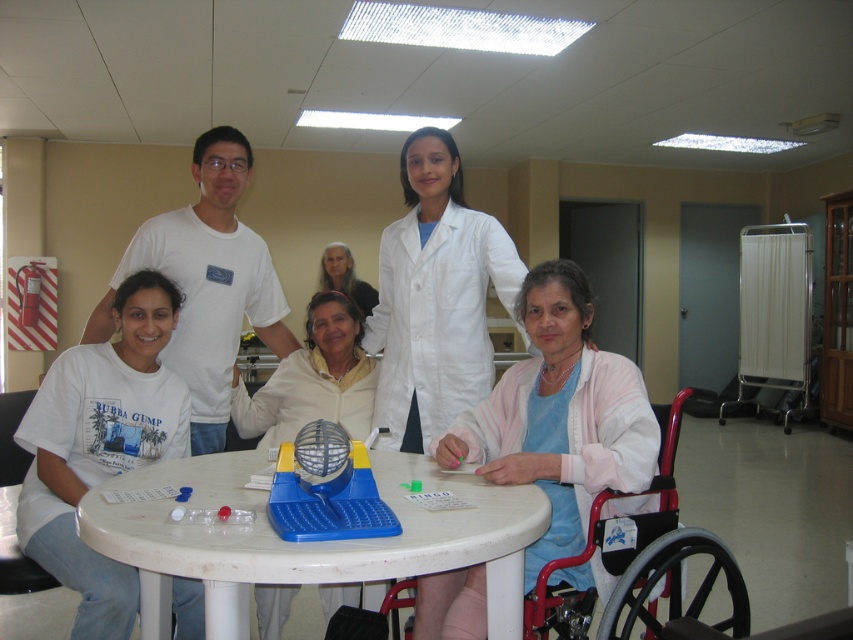
Question: Is red plastic wheelchair at lower right thinner than white matte bingo caller at center?

Choices:
 (A) no
 (B) yes

Answer: (A)

Question: Which point is closer to the camera?

Choices:
 (A) pink fabric at center
 (B) red plastic wheelchair at lower right

Answer: (A)

Question: Is pink fabric at center to the right of red plastic wheelchair at lower right from the viewer's perspective?

Choices:
 (A) yes
 (B) no

Answer: (B)

Question: Does white matte bingo caller at center appear under smooth white hair at upper center?

Choices:
 (A) no
 (B) yes

Answer: (B)

Question: Which of the following is the closest to the observer?

Choices:
 (A) (403, 548)
 (B) (253, 428)
 (C) (62, 532)
 (D) (369, 301)

Answer: (A)

Question: Which of these objects is positioned closest to the smooth white hair at upper center?

Choices:
 (A) white plastic table at center
 (B) white cotton shirt at lower left
 (C) red plastic wheelchair at lower right
 (D) white lab coat at center

Answer: (D)